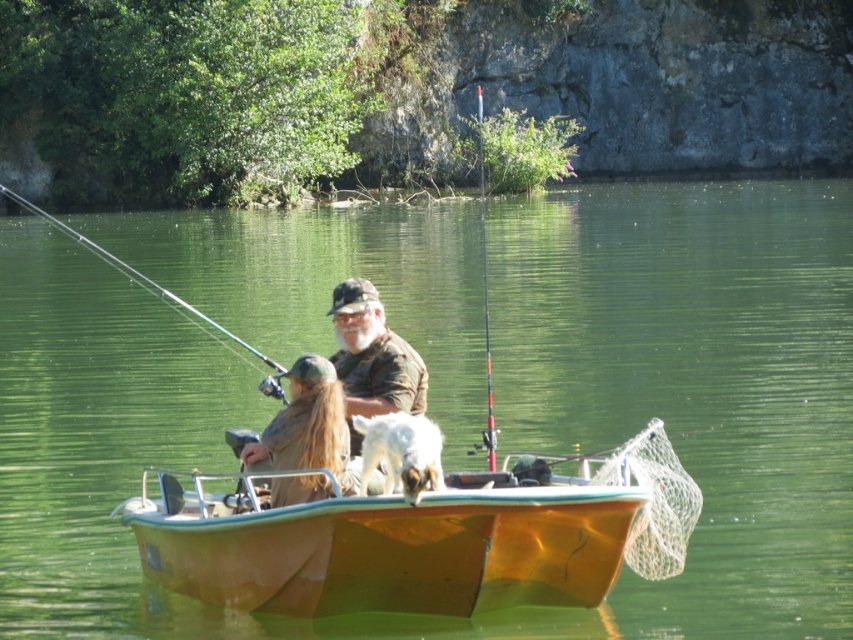
Which of these two, white mesh fishing net at right or matte black fishing pole at upper left, stands taller?

With more height is matte black fishing pole at upper left.

Locate an element on the screen. Image resolution: width=853 pixels, height=640 pixels. white mesh fishing net at right is located at coordinates (654, 500).

Find the location of `brown suede jacket at center`. brown suede jacket at center is located at coordinates (306, 426).

Is brown suede jacket at center thinner than matte black fishing pole at upper left?

Yes.

I want to click on brown suede jacket at center, so click(306, 426).

Where is `brown suede jacket at center`? The image size is (853, 640). brown suede jacket at center is located at coordinates (306, 426).

Is orange fiberglass fishing pole at center above matte black fishing pole at upper left?

Yes, orange fiberglass fishing pole at center is above matte black fishing pole at upper left.

Which of these two, orange fiberglass fishing pole at center or matte black fishing pole at upper left, stands shorter?

matte black fishing pole at upper left is shorter.

I want to click on orange fiberglass fishing pole at center, so click(485, 296).